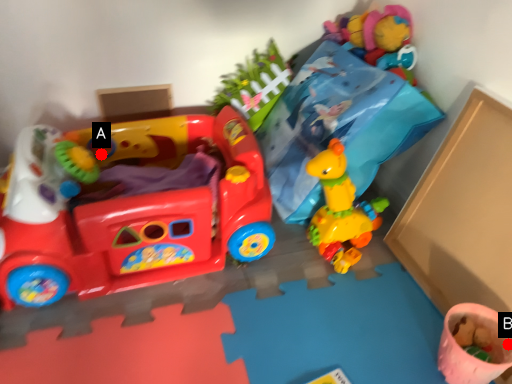
Question: Two points are circled on the image, labeled by A and B beside each circle. Which point is closer to the camera taking this photo?

Choices:
 (A) A is closer
 (B) B is closer

Answer: (B)